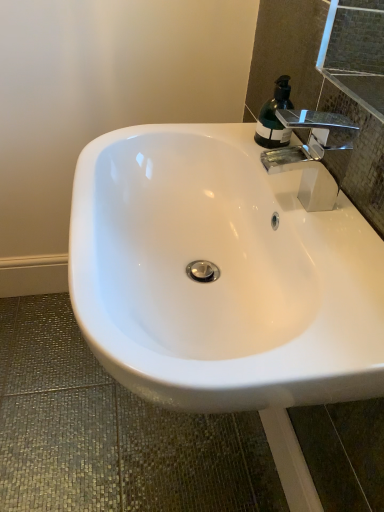
Question: Looking at the image, does chrome/metallic faucet at upper right seem bigger or smaller compared to translucent green bottle at upper right?

Choices:
 (A) small
 (B) big

Answer: (B)

Question: Considering the relative positions of chrome/metallic faucet at upper right and translucent green bottle at upper right in the image provided, is chrome/metallic faucet at upper right to the left or to the right of translucent green bottle at upper right?

Choices:
 (A) right
 (B) left

Answer: (A)

Question: Based on their relative distances, which object is farther from the white glossy sink at center?

Choices:
 (A) translucent green bottle at upper right
 (B) chrome/metallic faucet at upper right

Answer: (A)

Question: Which object is the farthest from the translucent green bottle at upper right?

Choices:
 (A) white glossy sink at center
 (B) chrome/metallic faucet at upper right

Answer: (A)